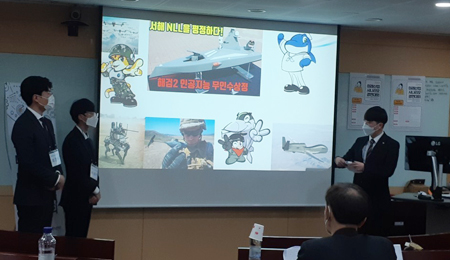
Image resolution: width=450 pixels, height=260 pixels. Identify the location of computer monitor. (419, 147).